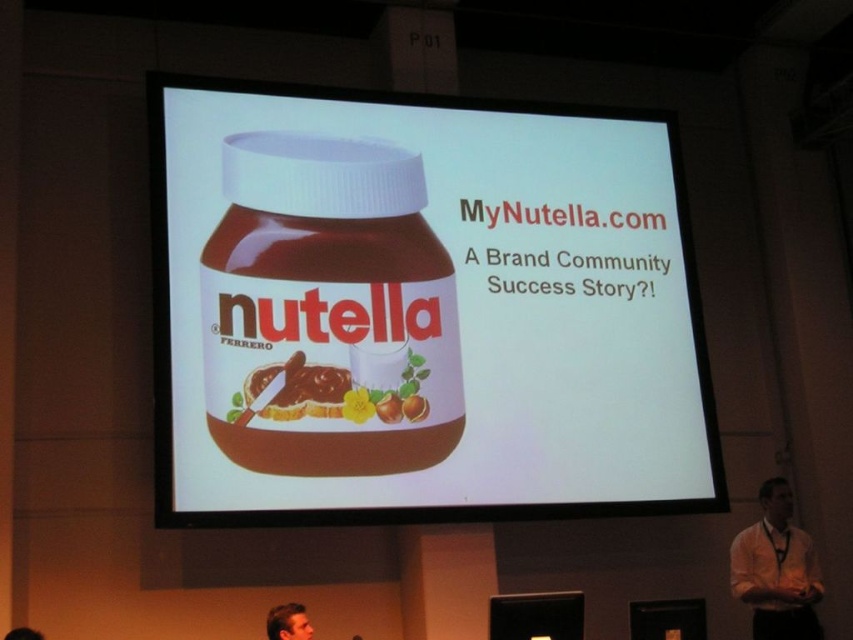
Who is more forward, (310, 387) or (289, 636)?

Point (289, 636) is in front.

The height and width of the screenshot is (640, 853). I want to click on chocolate spread at center, so click(x=309, y=392).

Does matte plastic jar of nutella at center appear under smooth skin face at lower center?

Incorrect, matte plastic jar of nutella at center is not positioned below smooth skin face at lower center.

Is matte plastic jar of nutella at center wider than smooth skin face at lower center?

Indeed, matte plastic jar of nutella at center has a greater width compared to smooth skin face at lower center.

Between point (561, 285) and point (306, 616), which one is positioned behind?

The point (561, 285) is behind.

Where is `matte plastic jar of nutella at center`? matte plastic jar of nutella at center is located at coordinates (422, 308).

Looking at this image, who is taller, matte plastic jar of nutella at center or chocolate spread at center?

With more height is matte plastic jar of nutella at center.

Between matte plastic jar of nutella at center and chocolate spread at center, which one has less height?

chocolate spread at center

Measure the distance between matte plastic jar of nutella at center and camera.

A distance of 11.62 meters exists between matte plastic jar of nutella at center and camera.

Identify the location of matte plastic jar of nutella at center. The width and height of the screenshot is (853, 640). (422, 308).